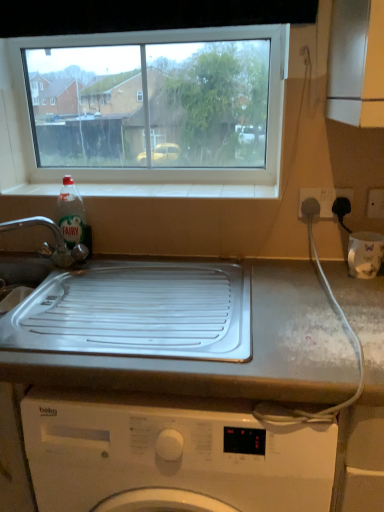
Question: Considering their positions, is white tile at upper center located in front of or behind white glossy countertop at center?

Choices:
 (A) front
 (B) behind

Answer: (B)

Question: From a real-world perspective, is white tile at upper center above or below white glossy countertop at center?

Choices:
 (A) above
 (B) below

Answer: (A)

Question: Considering the real-world distances, which object is farthest from the white tile at upper center?

Choices:
 (A) white plastic socket at upper right, which is counted as the first electric outlet, starting from the left
 (B) white plastic electric outlet at right, positioned as the 2th electric outlet in left-to-right order
 (C) transparent glass window at upper center
 (D) brushed metal tap at left
 (E) clear plastic bottle at sink left

Answer: (C)

Question: Estimate the real-world distances between objects in this image. Which object is closer to the white tile at upper center?

Choices:
 (A) clear plastic bottle at sink left
 (B) transparent glass window at upper center
 (C) white plastic socket at upper right, marked as the second electric outlet in a right-to-left arrangement
 (D) brushed metal tap at left
 (E) white plastic electric outlet at right, which is counted as the first electric outlet, starting from the right

Answer: (A)